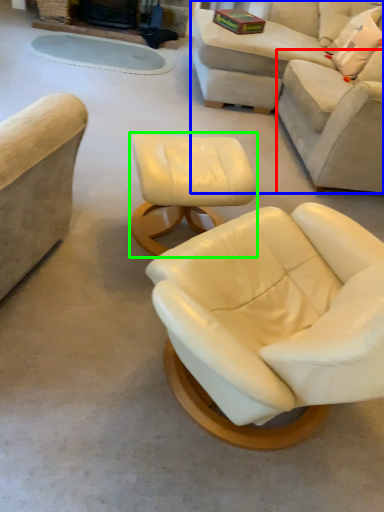
Question: Which is farther away from couch (highlighted by a red box)? studio couch (highlighted by a blue box) or table (highlighted by a green box)?

Choices:
 (A) studio couch
 (B) table

Answer: (B)